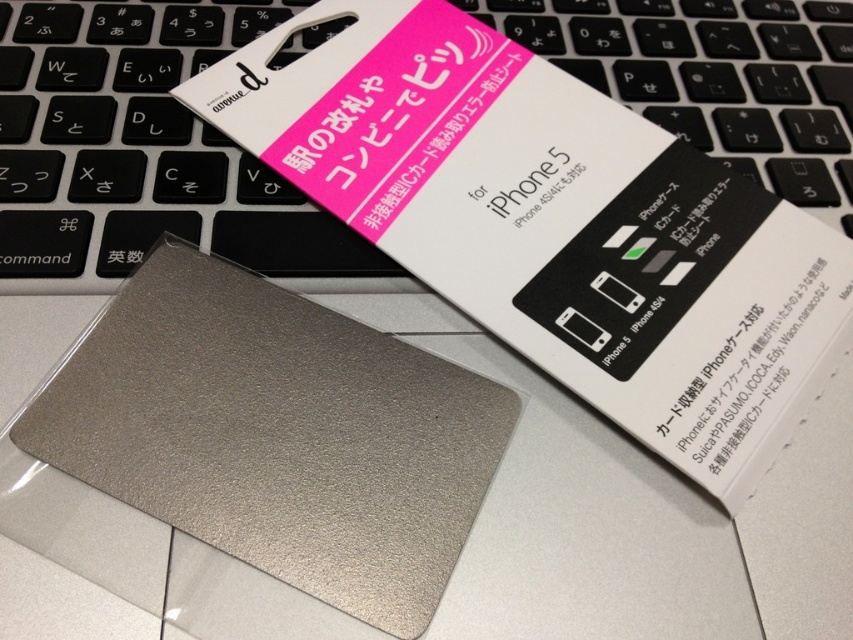
You are trying to determine if the metallic silver card at center can be placed on top of the satin silver keyboard at center without overlapping the edges. Based on their sizes, what do you think?

The metallic silver card at center is larger in size than the satin silver keyboard at center, so placing it on top would cause the edges of the card to extend beyond the keyboard, resulting in overlap.

You are trying to place the metallic silver card at center on top of the satin silver keyboard at center. Based on their sizes, will the card fit entirely on the keyboard without overhanging the edges?

The metallic silver card at center might be wider than the satin silver keyboard at center, so there is a possibility that the card will overhang the edges of the keyboard. It is recommended to check the exact dimensions before placing it.